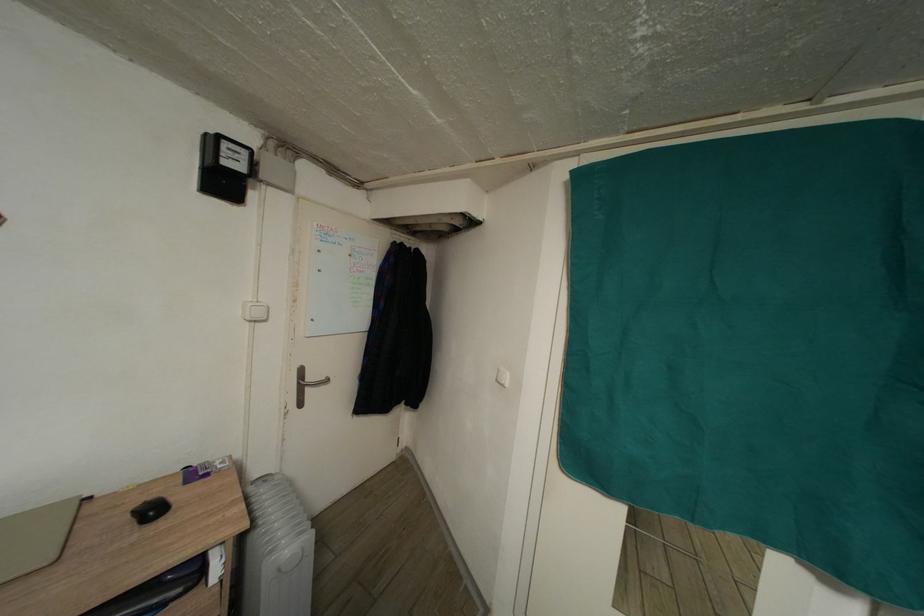
Image resolution: width=924 pixels, height=616 pixels. I want to click on metal door handle, so click(x=305, y=385).